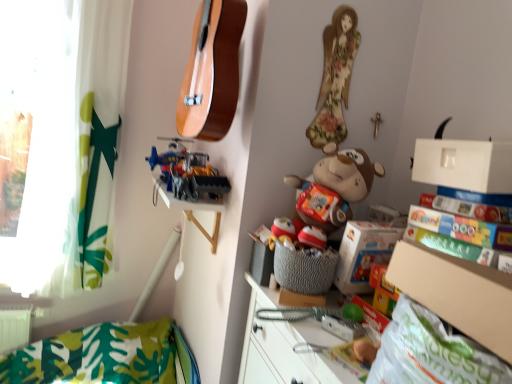
Question: From the image's perspective, is transparent plastic window screen at upper left below floral fabric doll at upper right?

Choices:
 (A) no
 (B) yes

Answer: (B)

Question: Is transparent plastic window screen at upper left located outside floral fabric doll at upper right?

Choices:
 (A) yes
 (B) no

Answer: (A)

Question: From the image's perspective, is transparent plastic window screen at upper left on top of floral fabric doll at upper right?

Choices:
 (A) yes
 (B) no

Answer: (B)

Question: Does transparent plastic window screen at upper left have a greater width compared to floral fabric doll at upper right?

Choices:
 (A) yes
 (B) no

Answer: (A)

Question: From a real-world perspective, is transparent plastic window screen at upper left physically below floral fabric doll at upper right?

Choices:
 (A) no
 (B) yes

Answer: (B)

Question: Is transparent plastic window screen at upper left smaller than floral fabric doll at upper right?

Choices:
 (A) yes
 (B) no

Answer: (B)

Question: From a real-world perspective, is natural wood guitar at upper center over floral fabric doll at upper right?

Choices:
 (A) yes
 (B) no

Answer: (B)

Question: Does natural wood guitar at upper center have a larger size compared to floral fabric doll at upper right?

Choices:
 (A) no
 (B) yes

Answer: (B)

Question: Is floral fabric doll at upper right surrounded by natural wood guitar at upper center?

Choices:
 (A) no
 (B) yes

Answer: (A)

Question: Does natural wood guitar at upper center have a lesser width compared to floral fabric doll at upper right?

Choices:
 (A) no
 (B) yes

Answer: (A)

Question: From the image's perspective, is natural wood guitar at upper center located beneath floral fabric doll at upper right?

Choices:
 (A) no
 (B) yes

Answer: (A)

Question: Are natural wood guitar at upper center and floral fabric doll at upper right beside each other?

Choices:
 (A) yes
 (B) no

Answer: (B)

Question: Is brown plush monkey at center, the 2th toy from the left, closer to camera compared to white matte box at upper right?

Choices:
 (A) yes
 (B) no

Answer: (B)